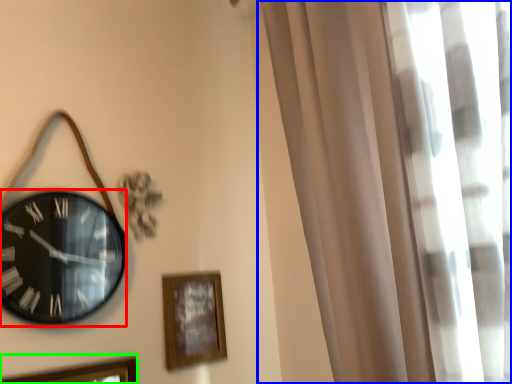
Question: Considering the real-world distances, which object is closest to wall clock (highlighted by a red box)? curtain (highlighted by a blue box) or picture frame (highlighted by a green box).

Choices:
 (A) curtain
 (B) picture frame

Answer: (B)